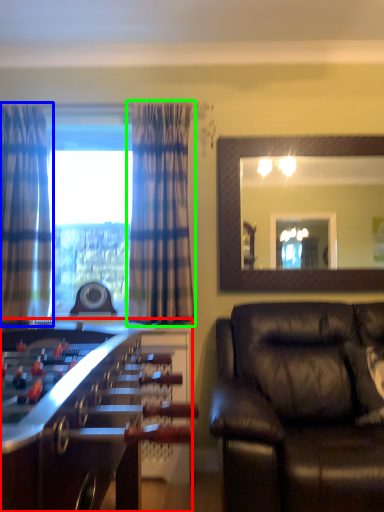
Question: Which object is the farthest from table (highlighted by a red box)? Choose among these: curtain (highlighted by a blue box) or curtain (highlighted by a green box).

Choices:
 (A) curtain
 (B) curtain

Answer: (A)